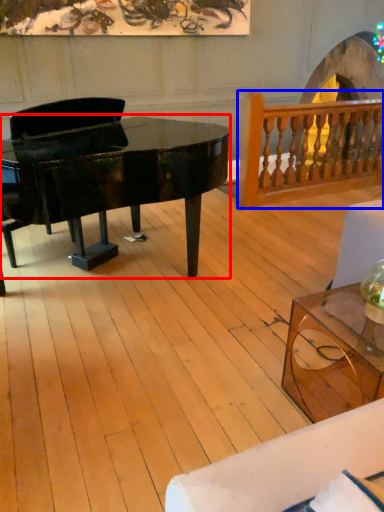
Question: Among these objects, which one is farthest to the camera, piano (highlighted by a red box) or rail (highlighted by a blue box)?

Choices:
 (A) piano
 (B) rail

Answer: (B)